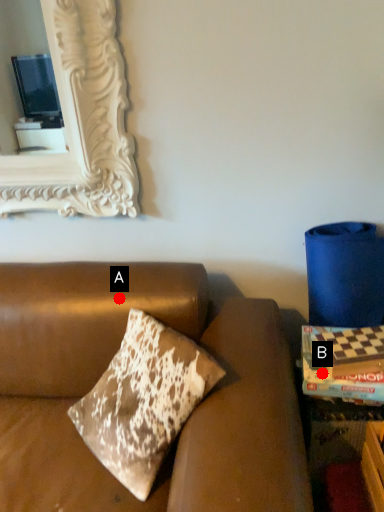
Question: Two points are circled on the image, labeled by A and B beside each circle. Which point appears closest to the camera in this image?

Choices:
 (A) A is closer
 (B) B is closer

Answer: (B)